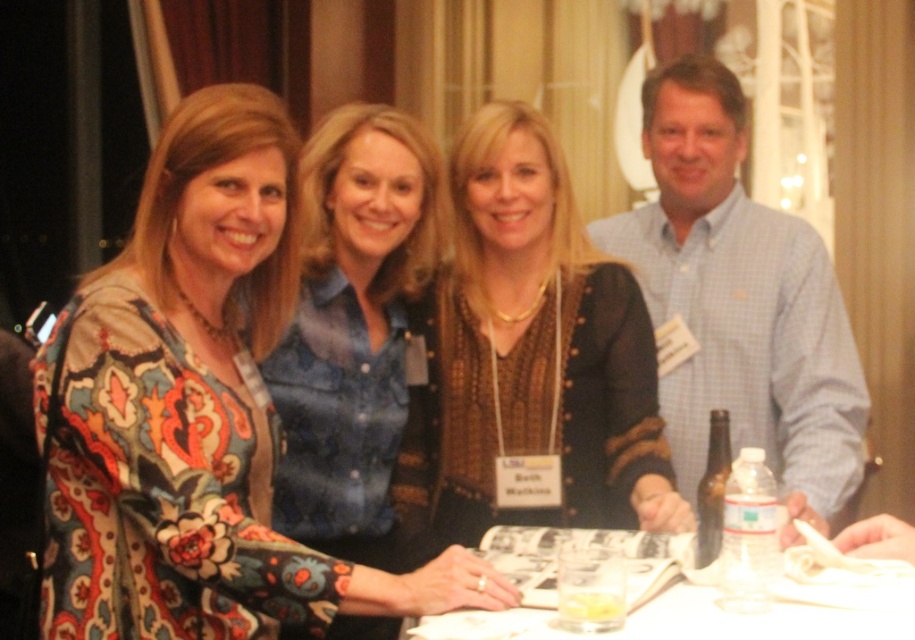
You are standing in the room where the group is posing. You want to move from your current position to a point closer to you. Which of the two points, point [93,289] or point [670,419], should you head towards?

You should head towards point [93,289] because it is closer to the viewer than point [670,419].